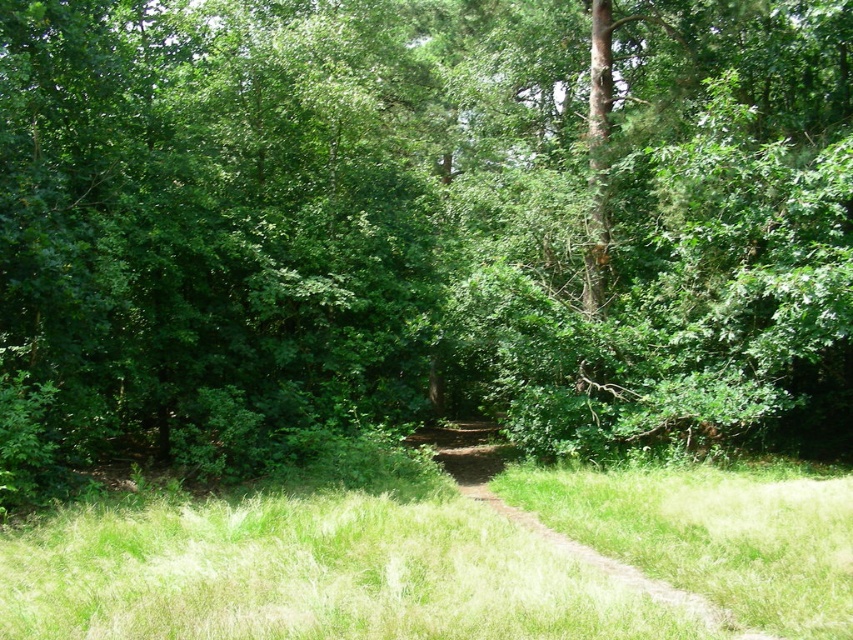
In the scene shown: Does green grass at center appear under brown dirt track at center?

No.

Locate an element on the screen. The height and width of the screenshot is (640, 853). green grass at center is located at coordinates (440, 557).

Where is `green grass at center`? The image size is (853, 640). green grass at center is located at coordinates (440, 557).